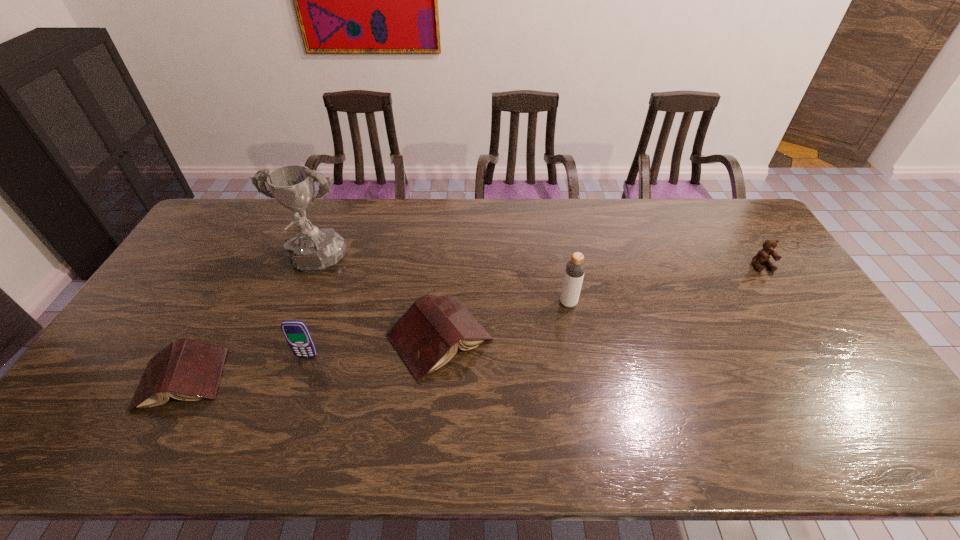
Locate an element on the screen. This screenshot has height=540, width=960. the shorter book is located at coordinates (188, 370).

The image size is (960, 540). I want to click on the shortest object, so click(188, 370).

Where is `the taller book`? The image size is (960, 540). the taller book is located at coordinates (427, 336).

The width and height of the screenshot is (960, 540). In order to click on the third object from right to left in this screenshot , I will do `click(427, 336)`.

Where is `teddy bear`? Image resolution: width=960 pixels, height=540 pixels. teddy bear is located at coordinates (763, 256).

This screenshot has width=960, height=540. I want to click on award, so click(312, 249).

At what (x,y) coordinates should I click in order to perform the action: click on bottle. Please return your answer as a coordinate pair (x, y). The image size is (960, 540). Looking at the image, I should click on (575, 268).

The image size is (960, 540). In order to click on the fifth shortest object in this screenshot , I will do `click(575, 268)`.

The height and width of the screenshot is (540, 960). Find the location of `the third tallest object`. the third tallest object is located at coordinates (296, 333).

Where is `free location located 0.060m on the left of the shortest object`? The width and height of the screenshot is (960, 540). free location located 0.060m on the left of the shortest object is located at coordinates (116, 380).